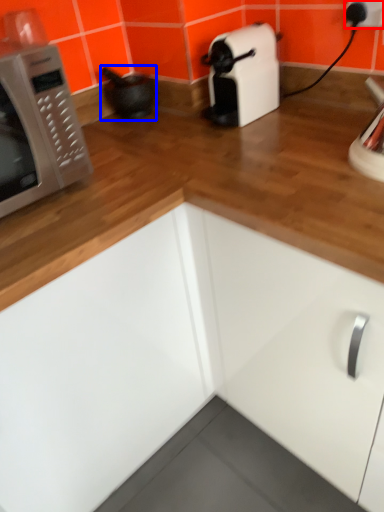
Question: Which point is further to the camera, electric outlet (highlighted by a red box) or appliance (highlighted by a blue box)?

Choices:
 (A) electric outlet
 (B) appliance

Answer: (B)